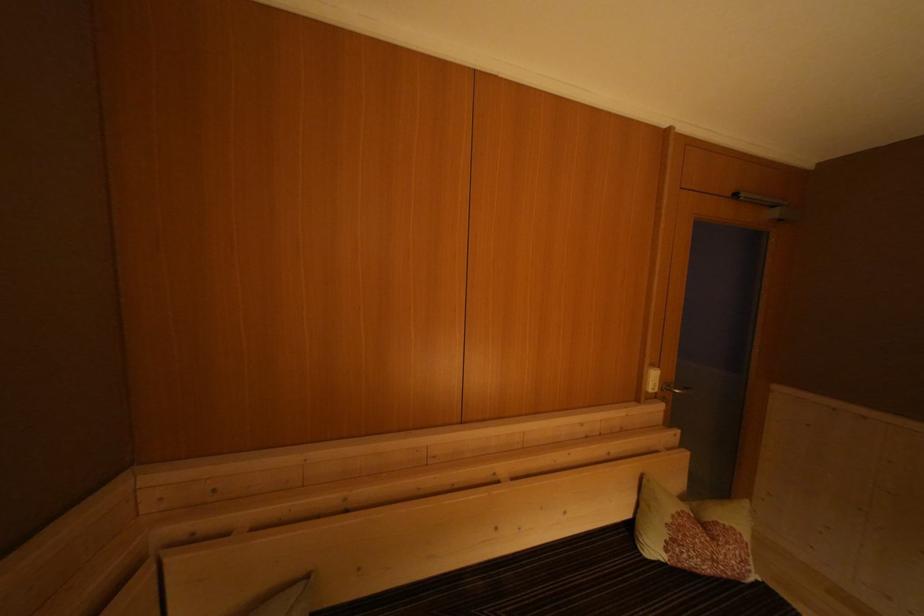
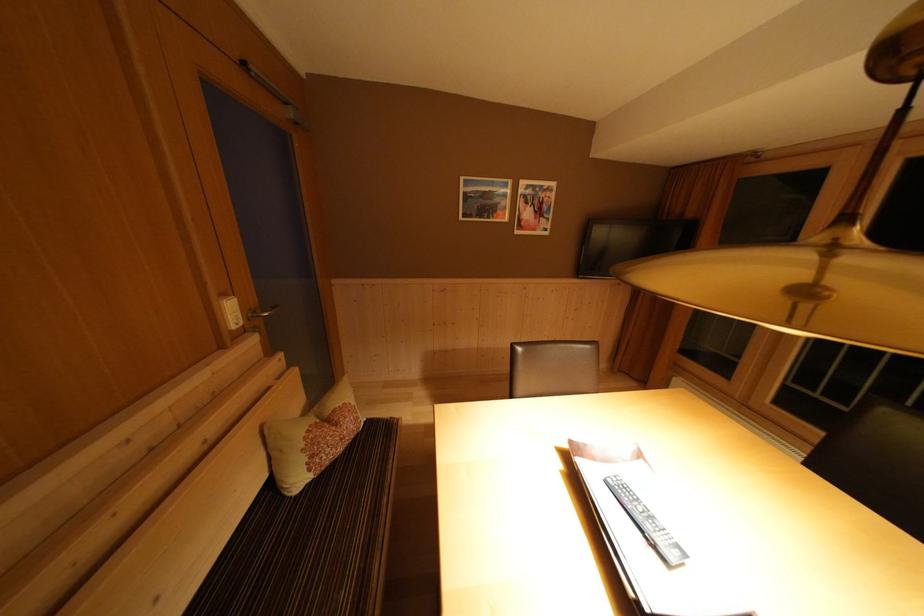
Locate, in the second image, the point that corresponds to (679,545) in the first image.

(319, 462)